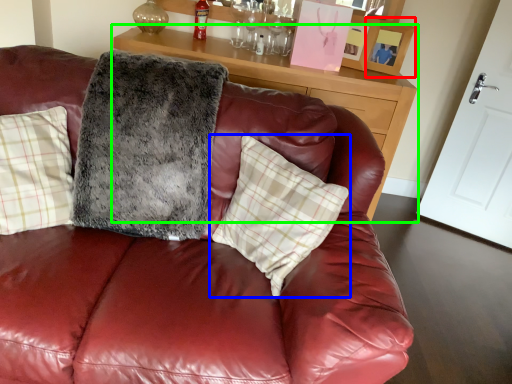
Question: Considering the real-world distances, which object is farthest from picture frame (highlighted by a red box)? pillow (highlighted by a blue box) or table (highlighted by a green box)?

Choices:
 (A) pillow
 (B) table

Answer: (A)